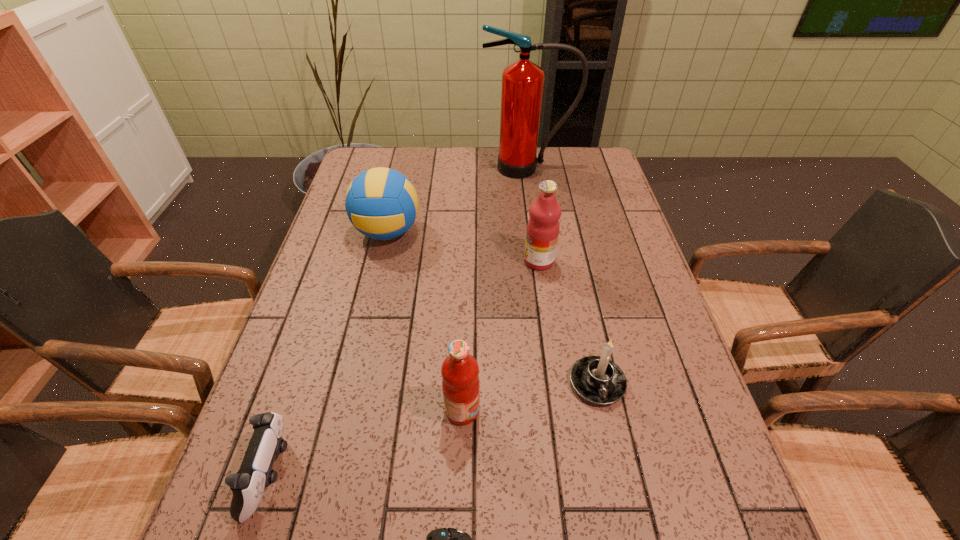
Locate an element on the screen. This screenshot has height=540, width=960. fire extinguisher is located at coordinates (522, 82).

Image resolution: width=960 pixels, height=540 pixels. I want to click on the farthest object, so click(x=522, y=82).

Where is `the right fruit juice`? This screenshot has height=540, width=960. the right fruit juice is located at coordinates [x=542, y=233].

I want to click on the left fruit juice, so click(460, 382).

Where is `the shorter fruit juice`? This screenshot has width=960, height=540. the shorter fruit juice is located at coordinates (460, 382).

This screenshot has height=540, width=960. What are the coordinates of `volleyball` in the screenshot? It's located at (381, 203).

Where is `candle holder`? Image resolution: width=960 pixels, height=540 pixels. candle holder is located at coordinates (598, 380).

The height and width of the screenshot is (540, 960). I want to click on the second shortest object, so click(x=255, y=474).

Identify the location of the second nearest object. (255, 474).

The image size is (960, 540). In order to click on free spot located 0.130m on the right of the farthest object in this screenshot , I will do `click(610, 168)`.